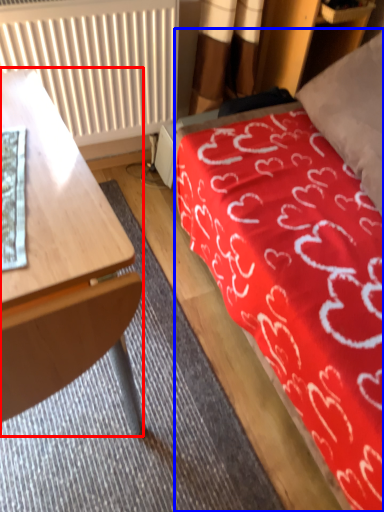
Question: Among these objects, which one is farthest to the camera, desk (highlighted by a red box) or bed (highlighted by a blue box)?

Choices:
 (A) desk
 (B) bed

Answer: (B)